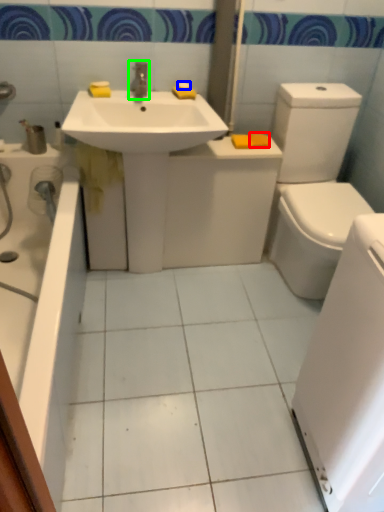
Question: Which is farther away from soap (highlighted by a red box)? soap (highlighted by a blue box) or tap (highlighted by a green box)?

Choices:
 (A) soap
 (B) tap

Answer: (B)